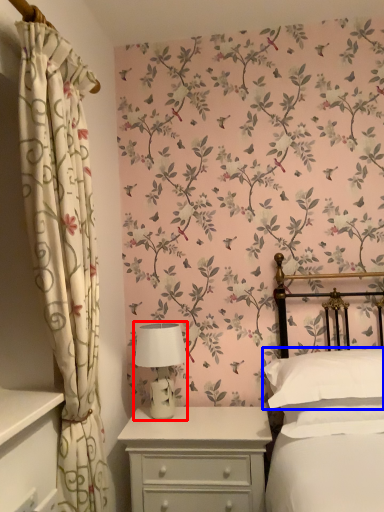
Question: Which of the following is the closest to the observer, table lamp (highlighted by a red box) or pillow (highlighted by a blue box)?

Choices:
 (A) table lamp
 (B) pillow

Answer: (B)